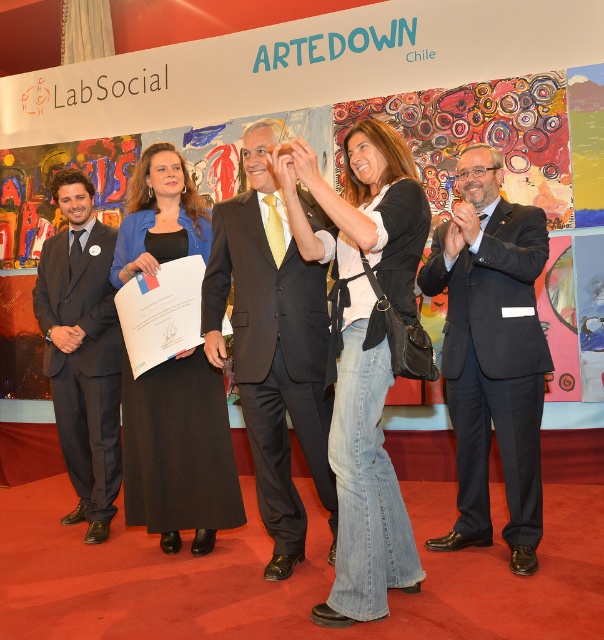
Who is more forward, (509, 396) or (181, 240)?

Point (509, 396)

Does dark blue suit at right come behind black fabric dress at center?

No.

Identify the location of dark blue suit at right. The image size is (604, 640). (492, 353).

Is jeans at center positioned in front of dark blue suit at right?

Yes, jeans at center is closer to the viewer.

Can you confirm if jeans at center is bigger than dark blue suit at right?

Yes.

Find the location of `jeans at center`. jeans at center is located at coordinates (362, 353).

I want to click on jeans at center, so click(x=362, y=353).

Between jeans at center and matte black suit at left, which one has more height?

matte black suit at left is taller.

Is jeans at center shorter than matte black suit at left?

Yes.

In the scene shown: Who is more forward, (359, 250) or (94, 337)?

Positioned in front is point (359, 250).

Identify the location of jeans at center. (362, 353).